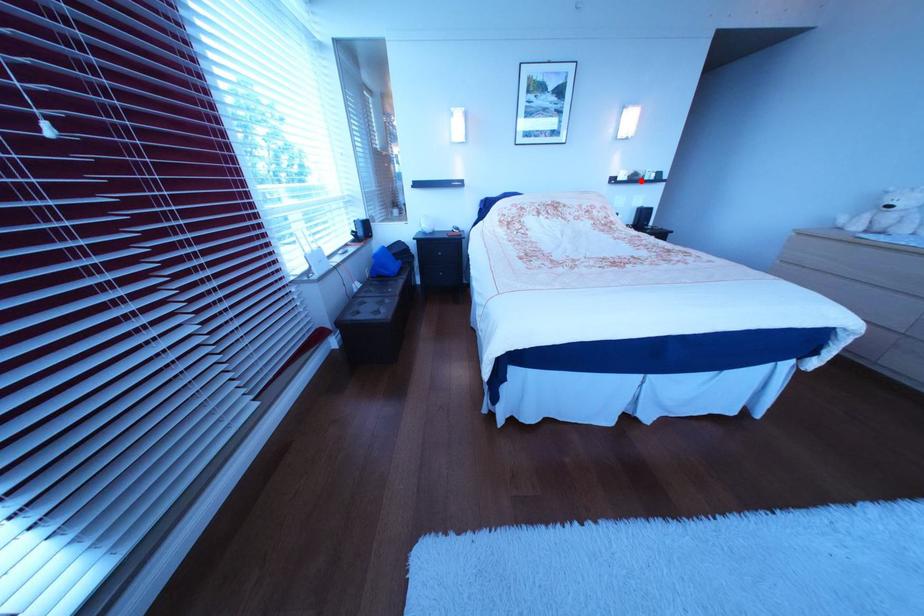
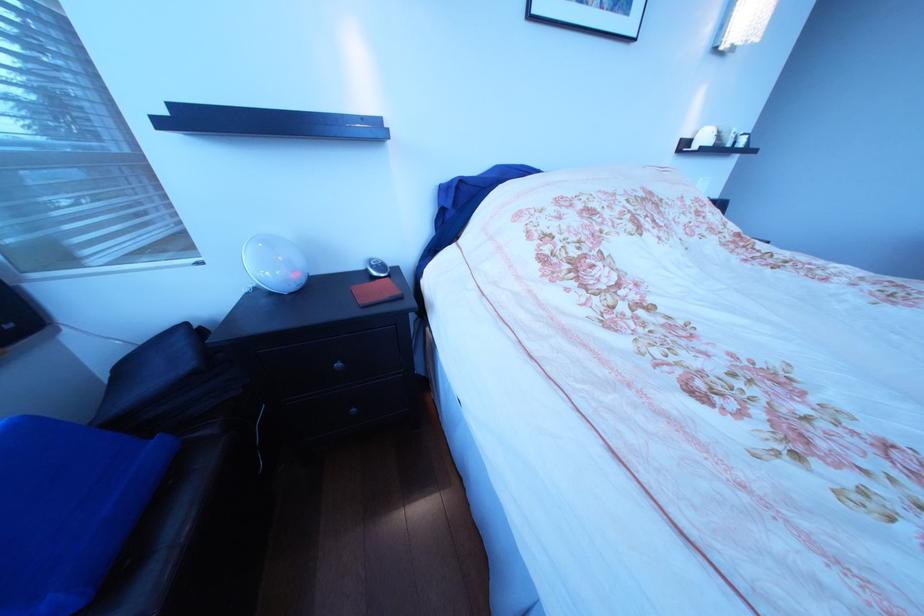
Find the pixel in the second image that matches the highlighted location in the first image.

(724, 146)